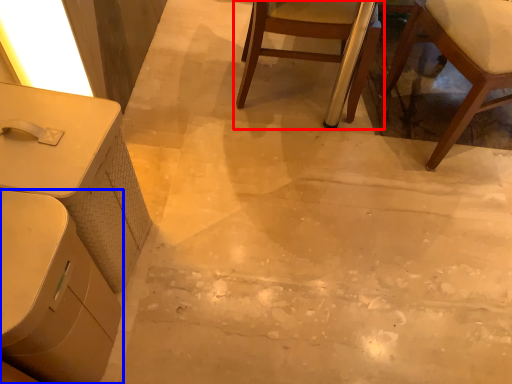
Question: Which object appears farthest to the camera in this image, chair (highlighted by a red box) or table (highlighted by a blue box)?

Choices:
 (A) chair
 (B) table

Answer: (A)